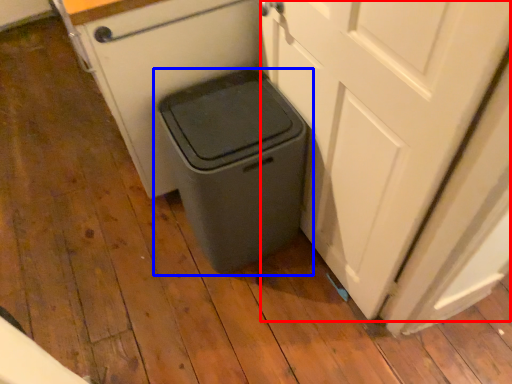
Question: Which object appears farthest to the camera in this image, screen door (highlighted by a red box) or waste container (highlighted by a blue box)?

Choices:
 (A) screen door
 (B) waste container

Answer: (B)